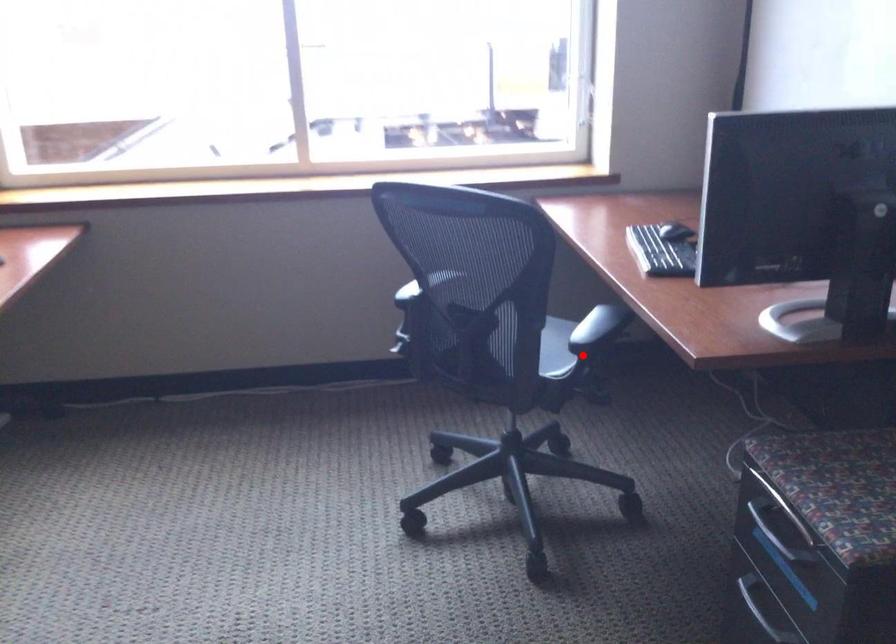
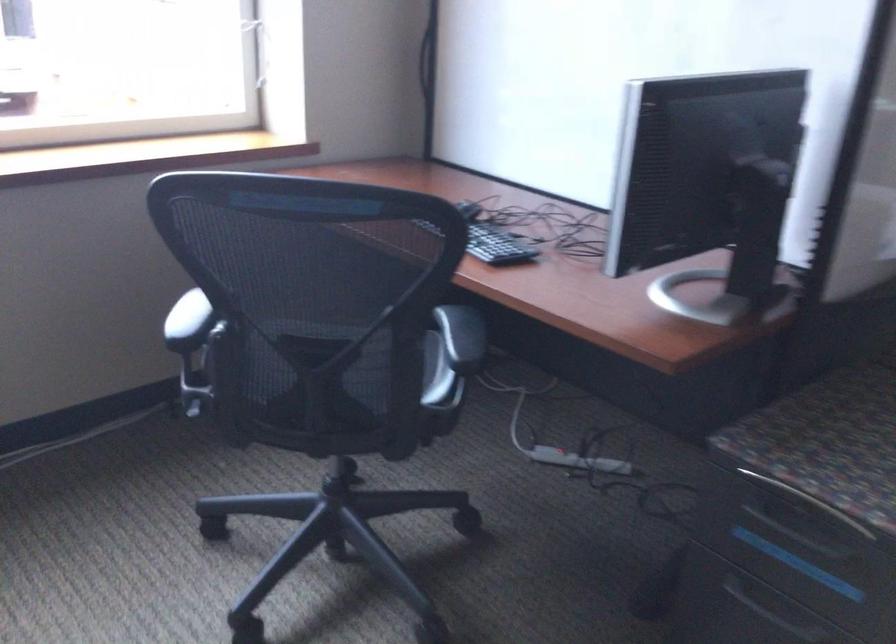
Find the pixel in the second image that matches the highlighted location in the first image.

(435, 373)